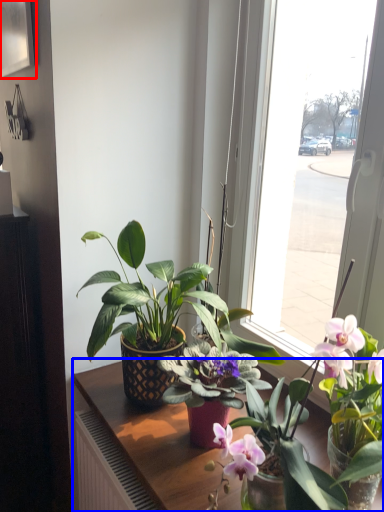
Question: Which point is further to the camera, picture frame (highlighted by a red box) or table (highlighted by a blue box)?

Choices:
 (A) picture frame
 (B) table

Answer: (A)